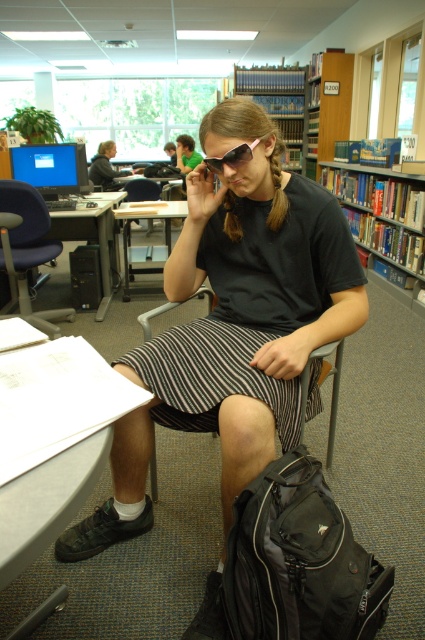
Question: Is wooden bookshelf at upper center thinner than green fabric shirt at center?

Choices:
 (A) yes
 (B) no

Answer: (B)

Question: Which object appears farthest from the camera in this image?

Choices:
 (A) matte black laptop at left
 (B) sunglasses at center
 (C) green fabric shirt at center
 (D) black fabric chair at center

Answer: (C)

Question: Among these points, which one is farthest from the camera?

Choices:
 (A) (88, 445)
 (B) (297, 134)
 (C) (407, 220)

Answer: (B)

Question: Is black fabric chair at center thinner than matte black laptop at left?

Choices:
 (A) yes
 (B) no

Answer: (A)

Question: Is matte black laptop at left to the right of green fabric shirt at center from the viewer's perspective?

Choices:
 (A) yes
 (B) no

Answer: (B)

Question: Which point appears closest to the camera in this image?

Choices:
 (A) (147, 259)
 (B) (214, 170)

Answer: (B)